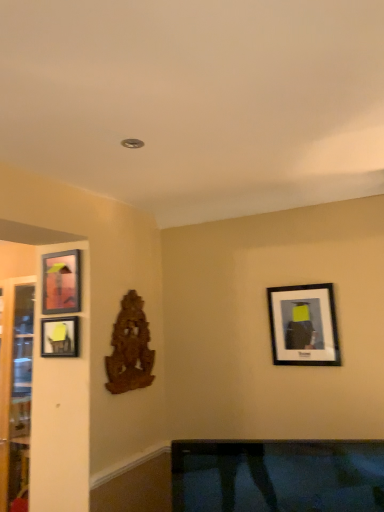
How much space does matte black picture frame at upper right, the 3th picture frame viewed from the left, occupy horizontally?

matte black picture frame at upper right, the 3th picture frame viewed from the left, is 1.91 inches in width.

Identify the location of matte black picture frame at left, arranged as the 2th picture frame when viewed from the right. Image resolution: width=384 pixels, height=512 pixels. (59, 337).

From a real-world perspective, count 3rd picture frames upward from the transparent glass door at left and point to it. Please provide its 2D coordinates.

[(61, 282)]

Consider the image. From a real-world perspective, who is located lower, transparent glass door at left or matte black picture frame at left, marked as the first picture frame in a left-to-right arrangement?

transparent glass door at left.

Looking at this image, do you think transparent glass door at left is within matte black picture frame at left, marked as the first picture frame in a left-to-right arrangement, or outside of it?

transparent glass door at left lies outside matte black picture frame at left, marked as the first picture frame in a left-to-right arrangement.

Does transparent glass door at left have a smaller size compared to matte black picture frame at left, acting as the 3th picture frame starting from the right?

No, transparent glass door at left is not smaller than matte black picture frame at left, acting as the 3th picture frame starting from the right.

In the scene shown: Between transparent glass door at left and wooden carving at center-left, which one has smaller size?

wooden carving at center-left.

Can you tell me how much transparent glass door at left and wooden carving at center-left differ in facing direction?

90.3 degrees.

Considering the relative positions of transparent glass door at left and wooden carving at center-left in the image provided, is transparent glass door at left to the left of wooden carving at center-left from the viewer's perspective?

Indeed, transparent glass door at left is positioned on the left side of wooden carving at center-left.

Does transparent glass door at left have a greater height compared to wooden carving at center-left?

Yes, transparent glass door at left is taller than wooden carving at center-left.

How distant is matte black picture frame at left, the 2th picture frame from the left, from transparent glass door at left?

They are 77.23 centimeters apart.

Consider the image. Is transparent glass door at left a part of matte black picture frame at left, the 2th picture frame from the left?

No.

Is matte black picture frame at left, the 2th picture frame from the left, taller or shorter than transparent glass door at left?

Clearly, matte black picture frame at left, the 2th picture frame from the left, is shorter compared to transparent glass door at left.

Is matte black picture frame at left, arranged as the 2th picture frame when viewed from the right, next to transparent glass door at left and touching it?

No, matte black picture frame at left, arranged as the 2th picture frame when viewed from the right, is not next to transparent glass door at left.

In the scene shown: Is wooden carving at center-left positioned with its back to matte black picture frame at upper right, which is the first picture frame from right to left?

wooden carving at center-left does not have its back to matte black picture frame at upper right, which is the first picture frame from right to left.

Locate an element on the screen. The image size is (384, 512). the 1st picture frame in front of the wooden carving at center-left is located at coordinates (304, 325).

What's the angular difference between wooden carving at center-left and matte black picture frame at upper right, which is the first picture frame from right to left,'s facing directions?

The facing directions of wooden carving at center-left and matte black picture frame at upper right, which is the first picture frame from right to left, are 90.4 degrees apart.

From the picture: From a real-world perspective, is wooden carving at center-left below matte black picture frame at upper right, the 3th picture frame viewed from the left?

Yes, from a real-world perspective, wooden carving at center-left is below matte black picture frame at upper right, the 3th picture frame viewed from the left.

How far apart are matte black picture frame at upper right, which is the first picture frame from right to left, and matte black picture frame at left, the 2th picture frame from the left?

matte black picture frame at upper right, which is the first picture frame from right to left, and matte black picture frame at left, the 2th picture frame from the left, are 3.51 feet apart.

Where is `the 1st picture frame positioned above the matte black picture frame at left, arranged as the 2th picture frame when viewed from the right (from a real-world perspective)`? the 1st picture frame positioned above the matte black picture frame at left, arranged as the 2th picture frame when viewed from the right (from a real-world perspective) is located at coordinates click(304, 325).

Which object is closer to the camera, matte black picture frame at upper right, the 3th picture frame viewed from the left, or matte black picture frame at left, arranged as the 2th picture frame when viewed from the right?

Positioned in front is matte black picture frame at left, arranged as the 2th picture frame when viewed from the right.

Does matte black picture frame at upper right, which is the first picture frame from right to left, have a smaller size compared to matte black picture frame at left, the 2th picture frame from the left?

Actually, matte black picture frame at upper right, which is the first picture frame from right to left, might be larger than matte black picture frame at left, the 2th picture frame from the left.

In terms of size, does matte black picture frame at left, marked as the first picture frame in a left-to-right arrangement, appear bigger or smaller than wooden carving at center-left?

matte black picture frame at left, marked as the first picture frame in a left-to-right arrangement, is smaller than wooden carving at center-left.

Is matte black picture frame at left, acting as the 3th picture frame starting from the right, not near wooden carving at center-left?

matte black picture frame at left, acting as the 3th picture frame starting from the right, is near wooden carving at center-left, not far away.

Considering the relative sizes of matte black picture frame at left, acting as the 3th picture frame starting from the right, and wooden carving at center-left in the image provided, is matte black picture frame at left, acting as the 3th picture frame starting from the right, thinner than wooden carving at center-left?

Indeed, matte black picture frame at left, acting as the 3th picture frame starting from the right, has a lesser width compared to wooden carving at center-left.

Does point (52, 287) appear closer or farther from the camera than point (144, 338)?

Point (52, 287) appears to be closer to the viewer than point (144, 338).

Is wooden carving at center-left in contact with matte black picture frame at left, arranged as the 2th picture frame when viewed from the right?

wooden carving at center-left and matte black picture frame at left, arranged as the 2th picture frame when viewed from the right, are not in contact.

Based on the photo, would you say wooden carving at center-left contains matte black picture frame at left, arranged as the 2th picture frame when viewed from the right?

No, matte black picture frame at left, arranged as the 2th picture frame when viewed from the right, is located outside of wooden carving at center-left.

Is wooden carving at center-left looking in the opposite direction of matte black picture frame at left, the 2th picture frame from the left?

No, matte black picture frame at left, the 2th picture frame from the left, is not at the back of wooden carving at center-left.

Where is `glass door lying on the left of matte black picture frame at left, acting as the 3th picture frame starting from the right`? This screenshot has width=384, height=512. glass door lying on the left of matte black picture frame at left, acting as the 3th picture frame starting from the right is located at coordinates (15, 391).

Locate an element on the screen. glass door located underneath the wooden carving at center-left (from a real-world perspective) is located at coordinates (15, 391).

Based on the photo, estimate the real-world distances between objects in this image. Which object is closer to matte black picture frame at left, acting as the 3th picture frame starting from the right, matte black picture frame at upper right, which is the first picture frame from right to left, or wooden carving at center-left?

wooden carving at center-left is positioned closer to the anchor matte black picture frame at left, acting as the 3th picture frame starting from the right.

When comparing their distances from transparent glass door at left, does matte black picture frame at left, marked as the first picture frame in a left-to-right arrangement, or wooden carving at center-left seem further?

wooden carving at center-left.

When comparing their distances from matte black picture frame at upper right, the 3th picture frame viewed from the left, does wooden carving at center-left or matte black picture frame at left, marked as the first picture frame in a left-to-right arrangement, seem closer?

wooden carving at center-left.

From the image, which object appears to be nearer to transparent glass door at left, matte black picture frame at upper right, the 3th picture frame viewed from the left, or wooden carving at center-left?

Based on the image, wooden carving at center-left appears to be nearer to transparent glass door at left.

Considering their positions, is matte black picture frame at left, the 2th picture frame from the left, positioned further to matte black picture frame at upper right, which is the first picture frame from right to left, than transparent glass door at left?

transparent glass door at left is positioned further to the anchor matte black picture frame at upper right, which is the first picture frame from right to left.

Which object lies further to the anchor point wooden carving at center-left, matte black picture frame at upper right, the 3th picture frame viewed from the left, or matte black picture frame at left, acting as the 3th picture frame starting from the right?

matte black picture frame at upper right, the 3th picture frame viewed from the left, is further to wooden carving at center-left.

From the picture: Which object lies further to the anchor point transparent glass door at left, matte black picture frame at left, acting as the 3th picture frame starting from the right, or matte black picture frame at left, arranged as the 2th picture frame when viewed from the right?

matte black picture frame at left, acting as the 3th picture frame starting from the right, lies further to transparent glass door at left than the other object.

When comparing their distances from wooden carving at center-left, does matte black picture frame at left, the 2th picture frame from the left, or transparent glass door at left seem closer?

matte black picture frame at left, the 2th picture frame from the left, lies closer to wooden carving at center-left than the other object.

Where is `picture frame situated between matte black picture frame at left, marked as the first picture frame in a left-to-right arrangement, and matte black picture frame at upper right, which is the first picture frame from right to left, from left to right`? picture frame situated between matte black picture frame at left, marked as the first picture frame in a left-to-right arrangement, and matte black picture frame at upper right, which is the first picture frame from right to left, from left to right is located at coordinates click(59, 337).

Identify the location of art situated between matte black picture frame at left, acting as the 3th picture frame starting from the right, and matte black picture frame at upper right, the 3th picture frame viewed from the left, from left to right. click(130, 348).

The image size is (384, 512). Identify the location of art located between transparent glass door at left and matte black picture frame at upper right, the 3th picture frame viewed from the left, in the left-right direction. (130, 348).

Image resolution: width=384 pixels, height=512 pixels. I want to click on art situated between matte black picture frame at left, the 2th picture frame from the left, and matte black picture frame at upper right, the 3th picture frame viewed from the left, from left to right, so click(130, 348).